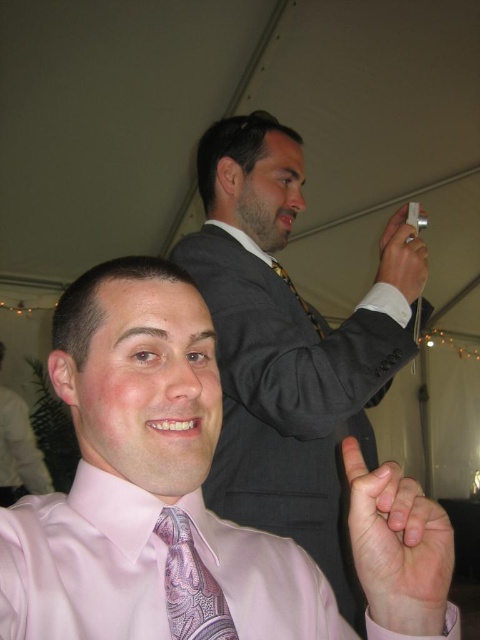
Between pink satin tie at lower center and patterned silk tie at upper center, which one is positioned lower?

pink satin tie at lower center is below.

Does pink satin tie at lower center appear under patterned silk tie at upper center?

Yes.

Describe the element at coordinates (397, 547) in the screenshot. I see `pink satin tie at lower center` at that location.

Find the location of `pink satin tie at lower center`. pink satin tie at lower center is located at coordinates (397, 547).

Measure the distance between pink satin shirt at lower left and pink paisley tie at lower center.

They are 3.66 inches apart.

Between point (118, 294) and point (195, 621), which one is positioned behind?

Positioned behind is point (118, 294).

Locate an element on the screen. This screenshot has width=480, height=640. pink satin shirt at lower left is located at coordinates (146, 486).

What are the coordinates of `white plastic remote at upper right` in the screenshot? It's located at (403, 257).

Identify the location of white plastic remote at upper right. This screenshot has height=640, width=480. (403, 257).